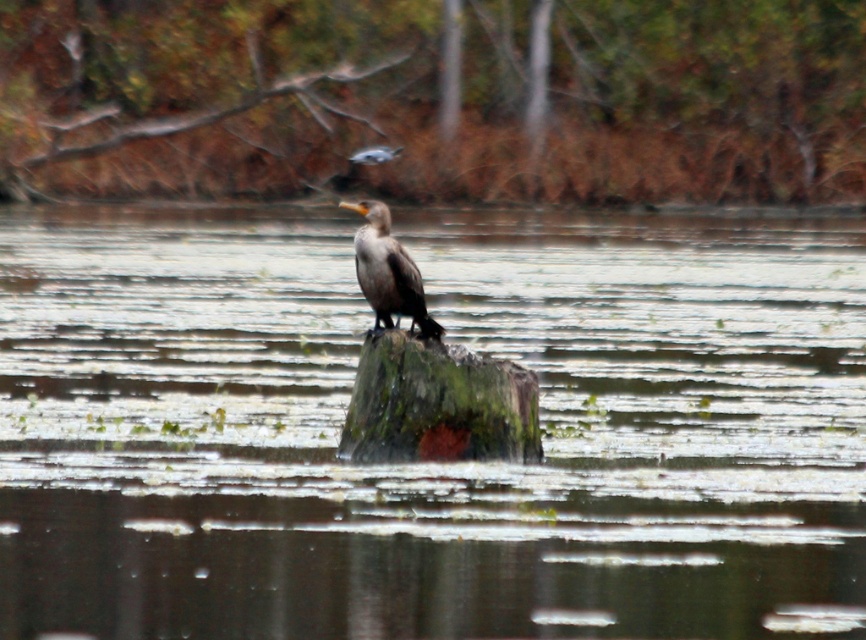
You are a wildlife photographer aiming to capture a closeup shot of the green mossy log at center. Your camera has a maximum zoom range of 10 meters. Can you take the photo without moving closer?

The green mossy log at center is 7.50 meters away from the camera. Since the camera can zoom up to 10 meters, you can take the closeup shot without moving closer.

You are a photographer trying to capture the bird in the scene. You notice the green mossy stump at center and the dark brown feathers at center. Which object is taller in the image?

The green mossy stump at center is taller than the dark brown feathers at center.